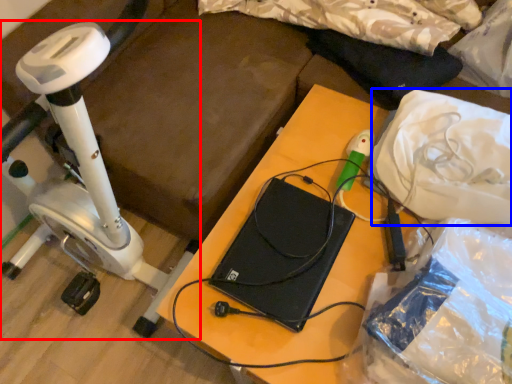
Question: Which object appears farthest to the camera in this image, stationary bicycle (highlighted by a red box) or material (highlighted by a blue box)?

Choices:
 (A) stationary bicycle
 (B) material

Answer: (B)